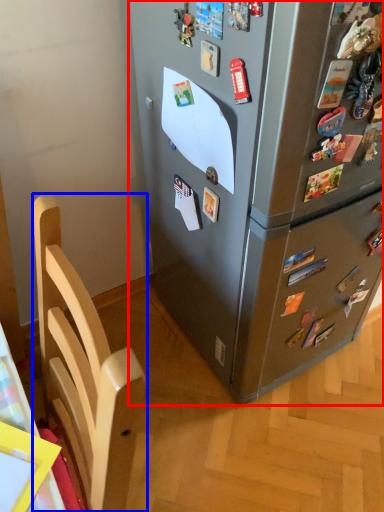
Question: Which point is further to the camera, refrigerator (highlighted by a red box) or furniture (highlighted by a blue box)?

Choices:
 (A) refrigerator
 (B) furniture

Answer: (A)